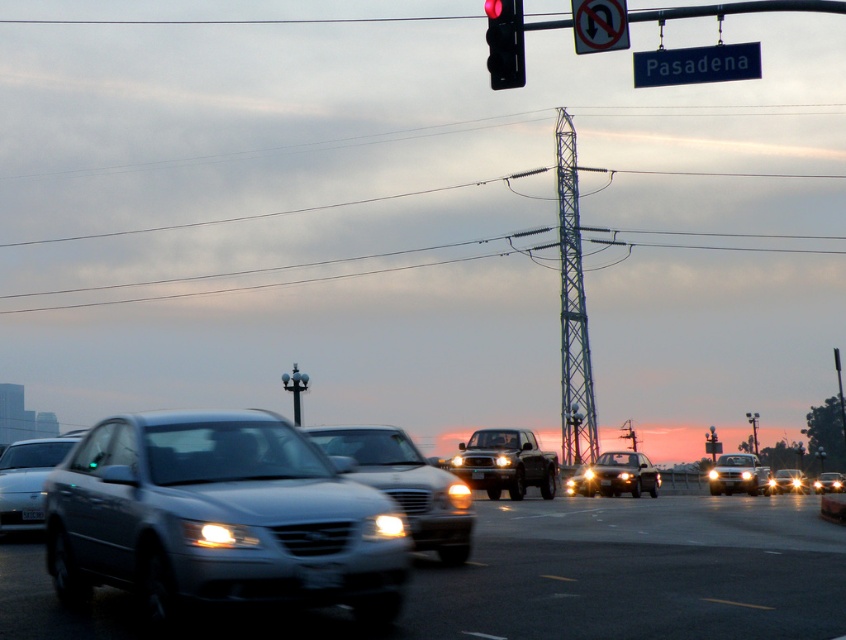
You are a pedestrian waiting to cross the street. You see a sleek silver sedan at center and a shiny black suv at center. Which vehicle is taller?

The sleek silver sedan at center is taller than the shiny black suv at center.

You are a pedestrian waiting to cross the street. You see the sleek silver sedan at center and the shiny black suv at center. Which vehicle should you wait for before stepping into the road?

You should wait for the sleek silver sedan at center to pass first because it is positioned to the left of the shiny black suv at center, meaning it is closer to you and moving towards your direction.